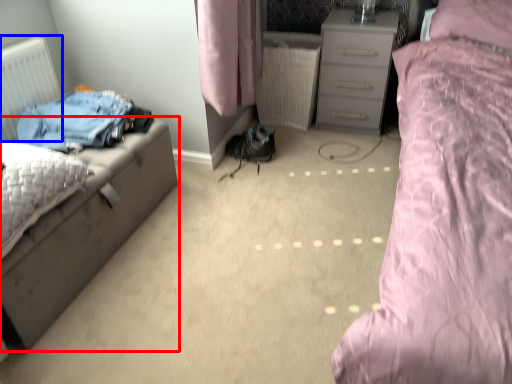
Question: Which object is further to the camera taking this photo, nightstand (highlighted by a red box) or radiator (highlighted by a blue box)?

Choices:
 (A) nightstand
 (B) radiator

Answer: (B)